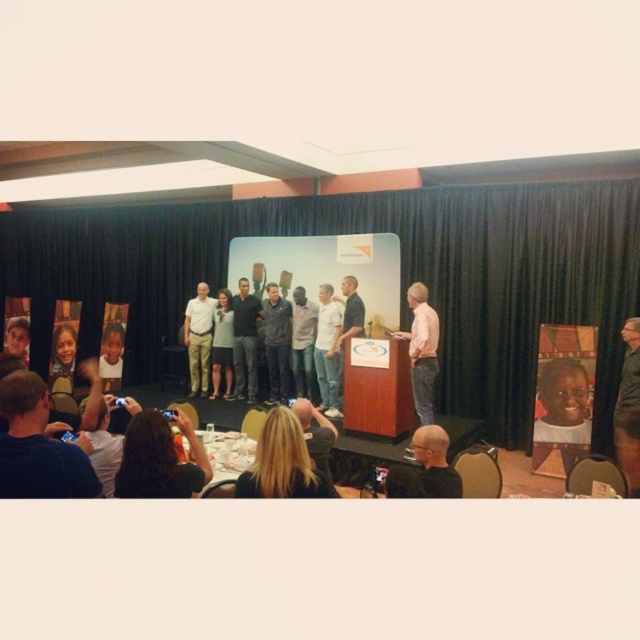
You are an event photographer at the back of the room. You want to take a photo of the white shirt at center and dark gray jacket at center so that both are clearly visible. Is there a chance that one might block the other in the photo?

The white shirt at center is positioned under dark gray jacket at center, so the dark gray jacket at center may block the white shirt at center in the photo.

You are attending the event and want to know if the person with dark brown hair at lower left can see the dark gray jacket at center without moving their head. Based on their heights, what do you think?

The dark brown hair at lower left is shorter than the dark gray jacket at center, so the person with dark brown hair at lower left can see the dark gray jacket at center without moving their head because the dark gray jacket at center is taller.

Looking at this image, you are an event photographer and need to adjust your camera settings to capture both the denim jeans at center and the light brown hair at center clearly. Since the camera can only focus on one object at a time, which object should you prioritize focusing on to ensure the wider one is in focus?

The light brown hair at center is wider than the denim jeans at center, so you should prioritize focusing on the light brown hair at center to ensure the wider object is in focus.